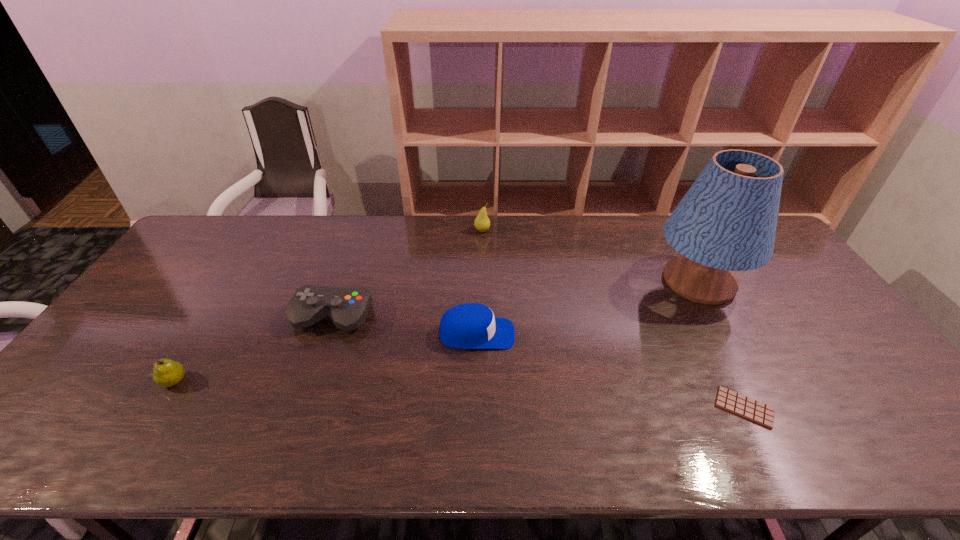
In the image, there is a desktop. In order to click on free space at the right edge in this screenshot , I will do `click(756, 285)`.

Where is `free space between the control and the nearer pear`? free space between the control and the nearer pear is located at coordinates (253, 349).

I want to click on blank region between the tallest object and the left pear, so click(437, 331).

The image size is (960, 540). I want to click on free point between the tallest object and the baseball cap, so (588, 307).

Identify the location of empty space that is in between the candy bar and the taller pear. The image size is (960, 540). (613, 319).

In order to click on blank region between the left pear and the shortest object in this screenshot , I will do `click(459, 394)`.

The width and height of the screenshot is (960, 540). What are the coordinates of `free area in between the leftmost object and the lampshade` in the screenshot? It's located at click(x=437, y=331).

This screenshot has width=960, height=540. In order to click on vacant space that is in between the right pear and the tallest object in this screenshot , I will do `click(590, 256)`.

Where is `free space between the fifth object from right to left and the candy bar`? free space between the fifth object from right to left and the candy bar is located at coordinates (539, 362).

Image resolution: width=960 pixels, height=540 pixels. Find the location of `free space between the farther pear and the tallest object`. free space between the farther pear and the tallest object is located at coordinates (590, 256).